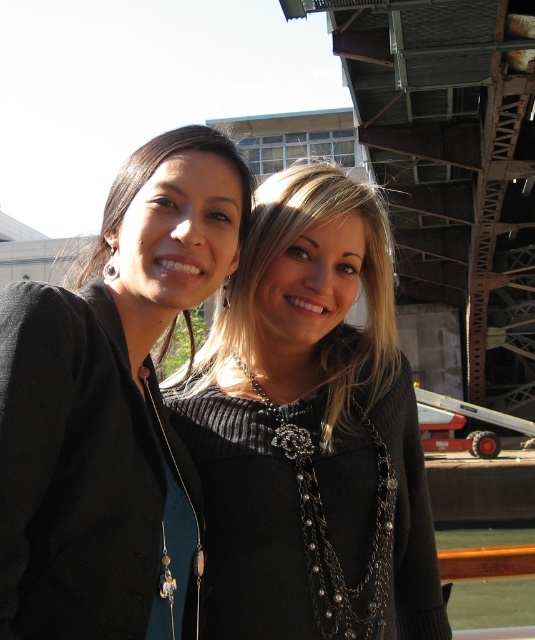
Question: Is matte black sweater at center positioned at the back of matte black sweater at upper left?

Choices:
 (A) yes
 (B) no

Answer: (A)

Question: Is matte black sweater at center smaller than matte black sweater at upper left?

Choices:
 (A) yes
 (B) no

Answer: (B)

Question: Can you confirm if matte black sweater at center is smaller than matte black sweater at upper left?

Choices:
 (A) yes
 (B) no

Answer: (B)

Question: Which point is farther to the camera?

Choices:
 (A) matte black sweater at upper left
 (B) matte black sweater at center

Answer: (B)

Question: Which point is closer to the camera?

Choices:
 (A) matte black sweater at center
 (B) matte black sweater at upper left

Answer: (B)